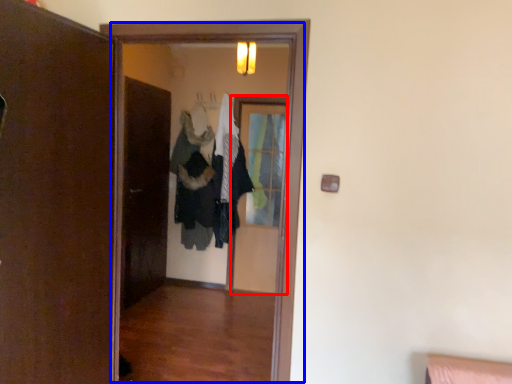
Question: Among these objects, which one is farthest to the camera, screen door (highlighted by a red box) or screen door (highlighted by a blue box)?

Choices:
 (A) screen door
 (B) screen door

Answer: (A)